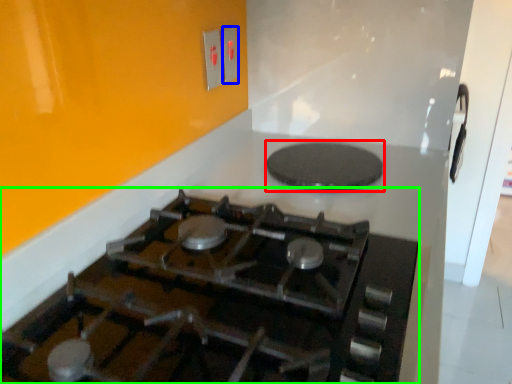
Question: Estimate the real-world distances between objects in this image. Which object is farther from pizza pan (highlighted by a red box), electric outlet (highlighted by a blue box) or gas stove (highlighted by a green box)?

Choices:
 (A) electric outlet
 (B) gas stove

Answer: (A)